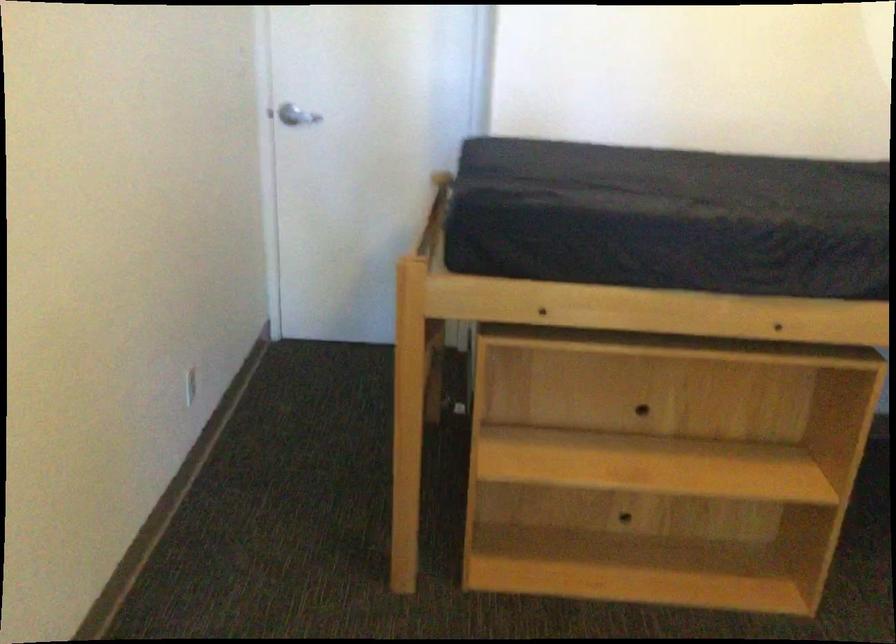
Identify the location of white wall outlet. The image size is (896, 644). (190, 386).